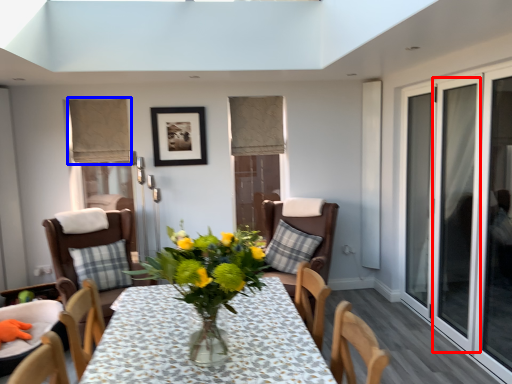
Question: Which of the following is the farthest to the observer, screen door (highlighted by a red box) or curtain (highlighted by a blue box)?

Choices:
 (A) screen door
 (B) curtain

Answer: (B)